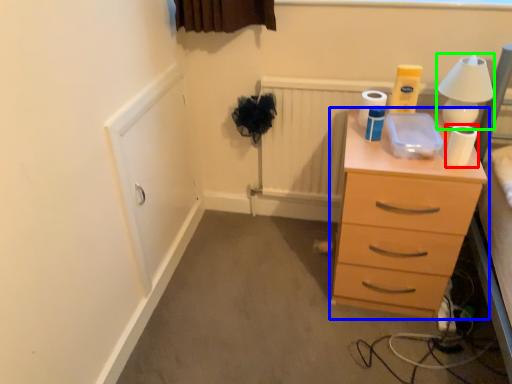
Question: Considering the real-world distances, which object is farthest from toilet paper (highlighted by a red box)? chest of drawers (highlighted by a blue box) or table lamp (highlighted by a green box)?

Choices:
 (A) chest of drawers
 (B) table lamp

Answer: (A)